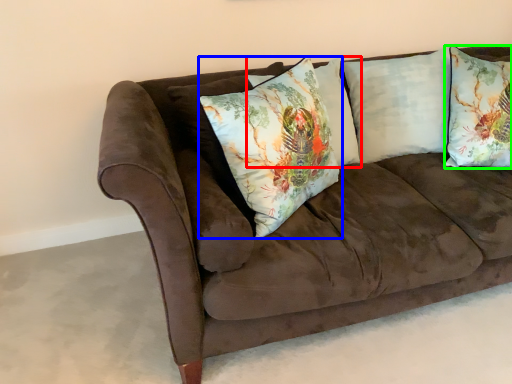
Question: Considering the real-world distances, which object is farthest from pillow (highlighted by a red box)? pillow (highlighted by a blue box) or pillow (highlighted by a green box)?

Choices:
 (A) pillow
 (B) pillow

Answer: (B)